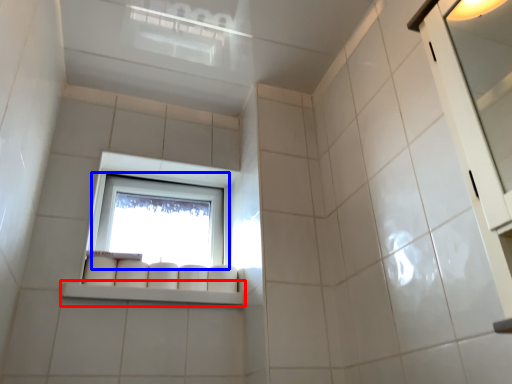
Question: Which object is further to the camera taking this photo, window sill (highlighted by a red box) or window (highlighted by a blue box)?

Choices:
 (A) window sill
 (B) window

Answer: (B)